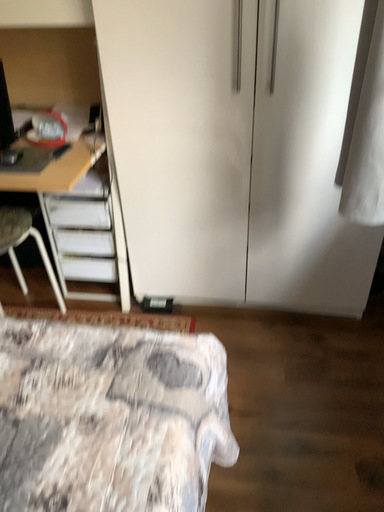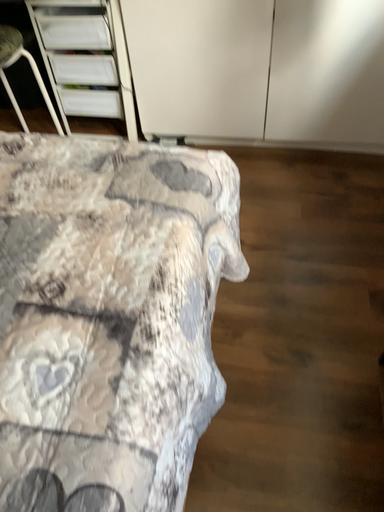
Question: How did the camera likely rotate when shooting the video?

Choices:
 (A) rotated downward
 (B) rotated upward

Answer: (A)